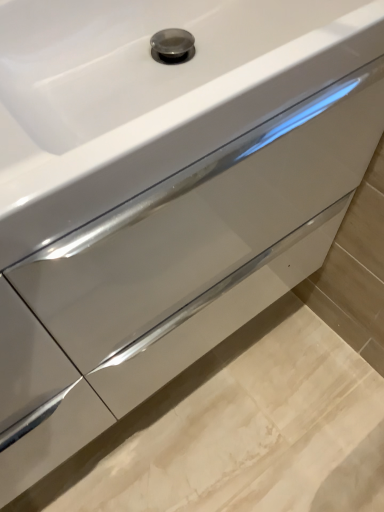
This screenshot has height=512, width=384. I want to click on white glossy sink at center, so click(x=156, y=84).

Describe the element at coordinates (156, 84) in the screenshot. This screenshot has height=512, width=384. I see `white glossy sink at center` at that location.

Image resolution: width=384 pixels, height=512 pixels. I want to click on white glossy sink at center, so click(156, 84).